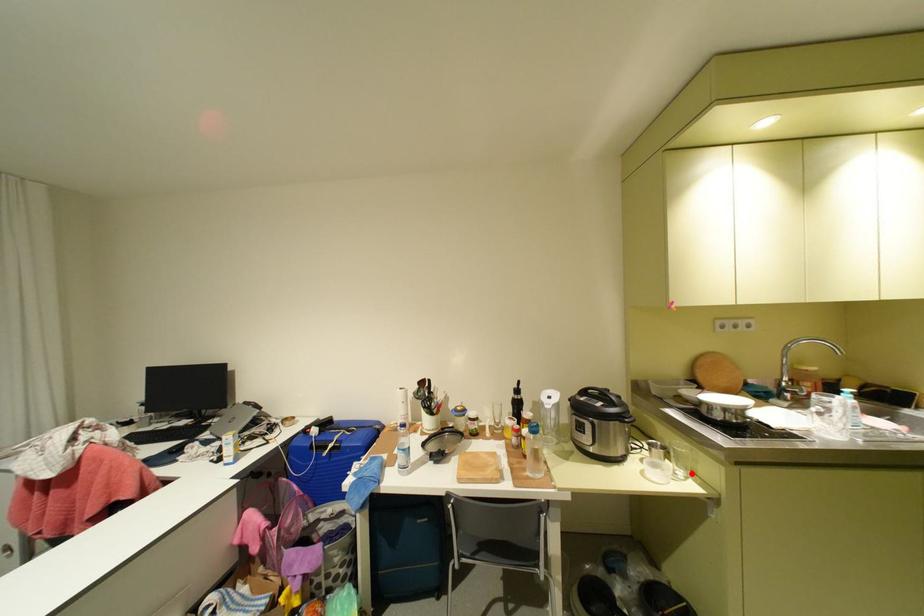
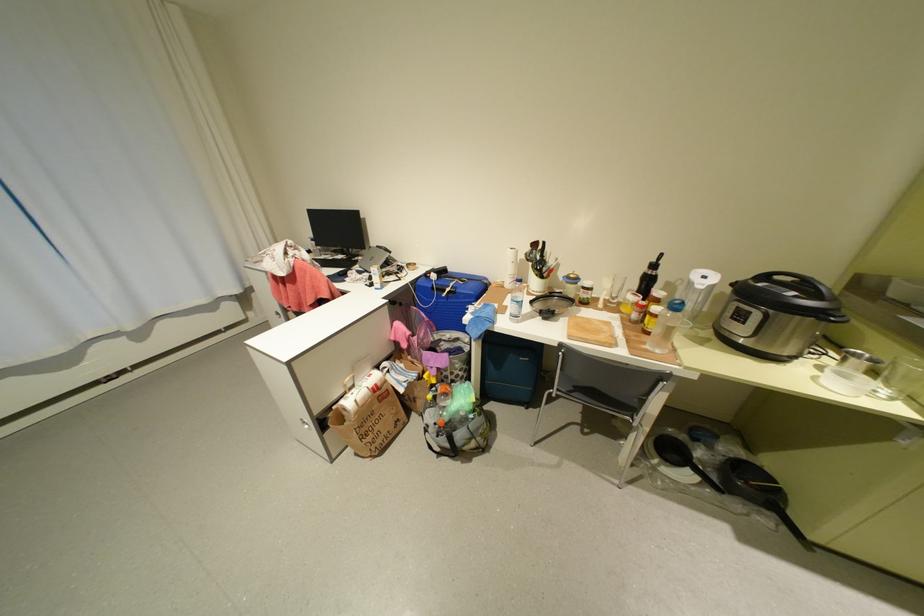
Question: A red point is marked in image1. In image2, is the corresponding 3D point closer to the camera or farther? Reply with the corresponding letter.

Choices:
 (A) The corresponding 3D point is closer.
 (B) The corresponding 3D point is farther.

Answer: (B)